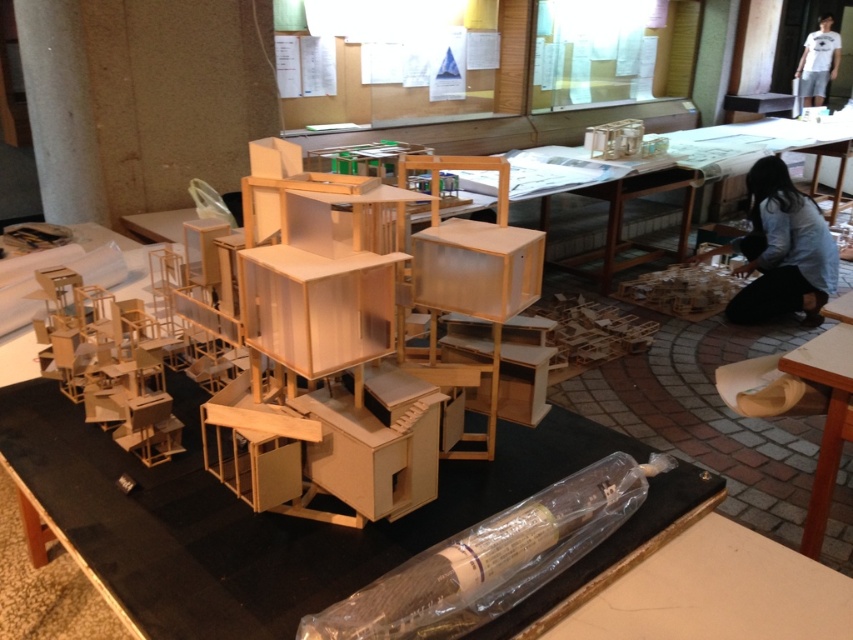
Can you confirm if wooden table at lower right is smaller than white cotton t-shirt at upper right?

Yes, wooden table at lower right is smaller than white cotton t-shirt at upper right.

Is wooden table at lower right taller than white cotton t-shirt at upper right?

No.

Is point (825, 467) positioned in front of point (834, 61)?

Yes, point (825, 467) is in front of point (834, 61).

Identify the location of wooden table at lower right. This screenshot has width=853, height=640. (825, 419).

What do you see at coordinates (781, 250) in the screenshot? The height and width of the screenshot is (640, 853). I see `light blue shirt at lower right` at bounding box center [781, 250].

Between light blue shirt at lower right and wooden table at lower right, which one appears on the left side from the viewer's perspective?

From the viewer's perspective, wooden table at lower right appears more on the left side.

What do you see at coordinates (781, 250) in the screenshot? I see `light blue shirt at lower right` at bounding box center [781, 250].

The image size is (853, 640). What are the coordinates of `light blue shirt at lower right` in the screenshot? It's located at (781, 250).

Which is below, light blue shirt at lower right or white cotton t-shirt at upper right?

light blue shirt at lower right

Can you confirm if light blue shirt at lower right is wider than white cotton t-shirt at upper right?

Incorrect, light blue shirt at lower right's width does not surpass white cotton t-shirt at upper right's.

The width and height of the screenshot is (853, 640). Describe the element at coordinates (781, 250) in the screenshot. I see `light blue shirt at lower right` at that location.

In order to click on light blue shirt at lower right in this screenshot , I will do `click(781, 250)`.